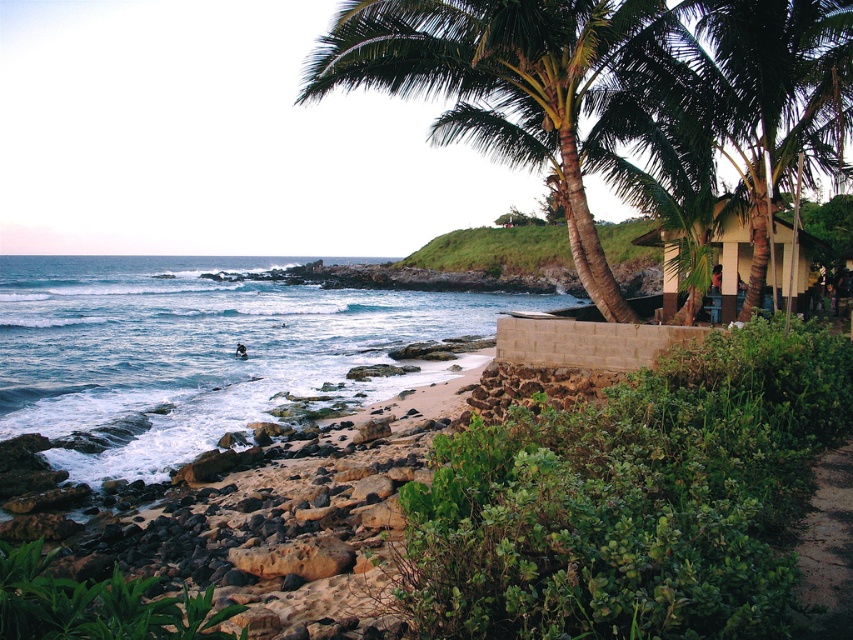
You are standing on the beach and want to walk towards the green grass at lower right. Which direction should you walk relative to the green leafy palm tree at upper right?

You should walk to the right of the green leafy palm tree at upper right because the green grass at lower right is located to the right side of the palm tree.

You are standing on the beach looking towards the water. You see the blue water at lower left and the green grass at lower right. Which one is closer to your feet?

The green grass at lower right is closer to your feet because the blue water at lower left is located above it.